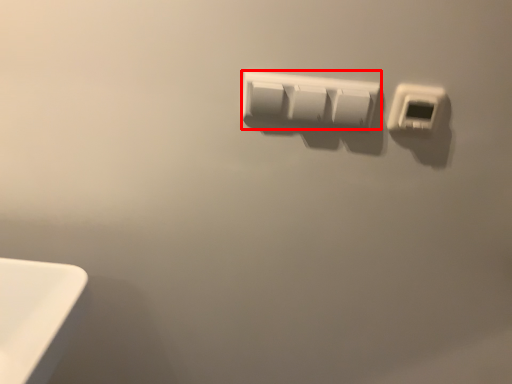
Question: Considering the relative positions of power plugs and sockets (annotated by the red box) and power plugs and sockets in the image provided, where is power plugs and sockets (annotated by the red box) located with respect to the staircase?

Choices:
 (A) left
 (B) right

Answer: (A)